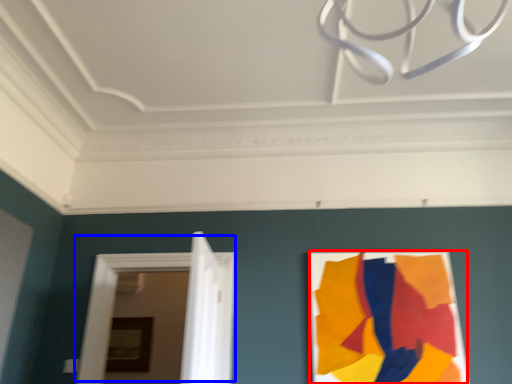
Question: Which of the following is the farthest to the observer, poster (highlighted by a red box) or door (highlighted by a blue box)?

Choices:
 (A) poster
 (B) door

Answer: (B)